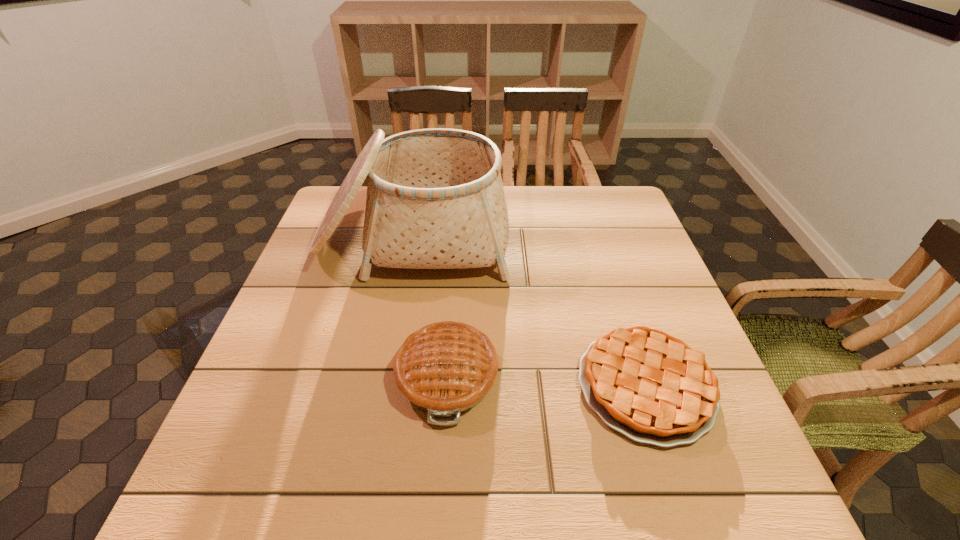
I want to click on blank space that satisfies the following two spatial constraints: 1. with the lid open on the second tallest object; 2. on the left side of the farthest object, so click(x=387, y=375).

You are a GUI agent. You are given a task and a screenshot of the screen. Output one action in this format:
    pyautogui.click(x=<x>, y=<y>)
    Task: Click on the vacant space that satisfies the following two spatial constraints: 1. with the lid open on the shorter pie; 2. on the left side of the basket
    The width and height of the screenshot is (960, 540).
    Given the screenshot: What is the action you would take?
    pyautogui.click(x=385, y=386)

Locate an element on the screen. This screenshot has height=540, width=960. vacant space that satisfies the following two spatial constraints: 1. on the front side of the shorter pie; 2. on the left side of the left pie is located at coordinates (446, 386).

Locate an element on the screen. free point that satisfies the following two spatial constraints: 1. with the lid open on the shorter pie; 2. on the left side of the basket is located at coordinates (385, 386).

Identify the location of free space that satisfies the following two spatial constraints: 1. with the lid open on the basket; 2. on the left side of the left pie. (387, 375).

You are a GUI agent. You are given a task and a screenshot of the screen. Output one action in this format:
    pyautogui.click(x=<x>, y=<y>)
    Task: Click on the vacant region that satisfies the following two spatial constraints: 1. on the front side of the rightmost object; 2. on the right side of the left pie
    This screenshot has height=540, width=960.
    Given the screenshot: What is the action you would take?
    pyautogui.click(x=446, y=386)